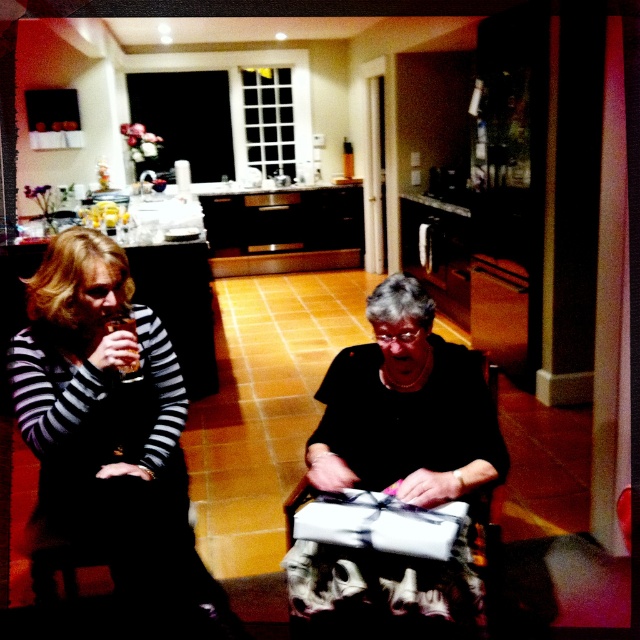
You are helping to organize a small gift wrapping station in the kitchen. You have the striped fabric dress at left and the black matte gift at center. Which item requires more space to handle?

The striped fabric dress at left requires more space to handle because it is larger in size than the black matte gift at center.

You are a guest at a dinner party and see the striped fabric dress at left and the black matte gift at center. Which item is located more to the left?

The striped fabric dress at left is positioned on the left side of the black matte gift at center, so it is more to the left.